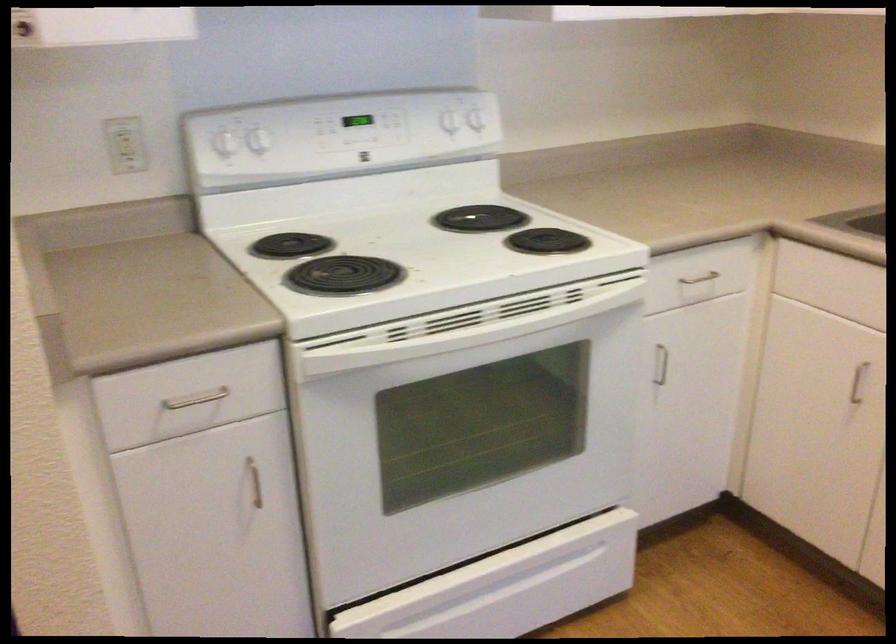
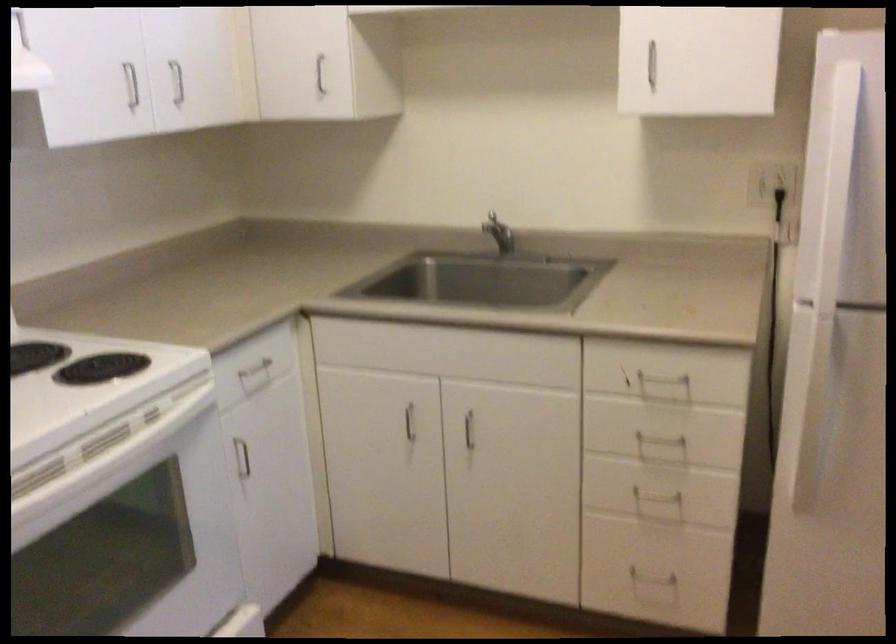
Where in the second image is the point corresponding to (x=521, y=325) from the first image?

(108, 459)